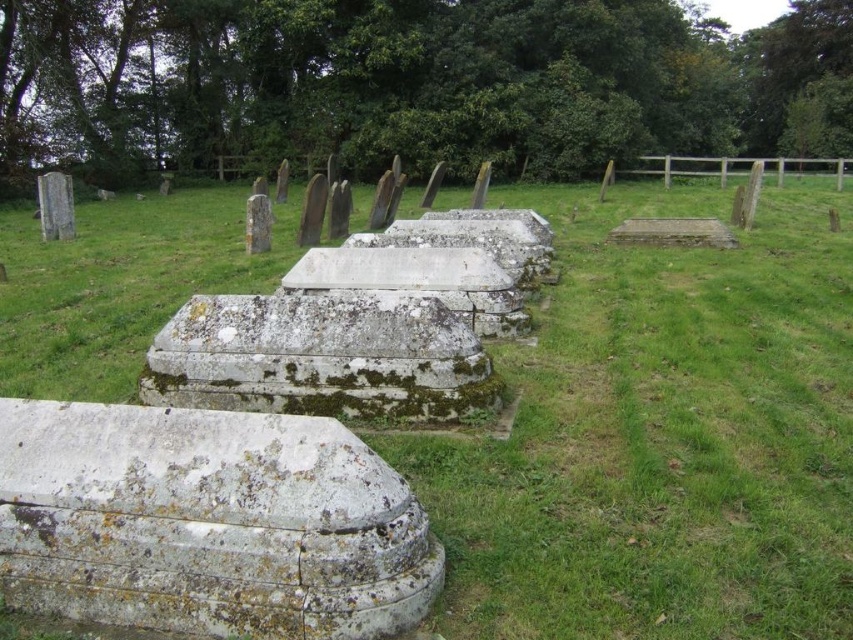
Question: Is green mossy stone at center behind mossy concrete sarcophagus at lower left?

Choices:
 (A) yes
 (B) no

Answer: (A)

Question: Which point appears farthest from the camera in this image?

Choices:
 (A) (44, 352)
 (B) (253, 321)

Answer: (A)

Question: Does green mossy stone at center appear on the right side of mossy concrete sarcophagus at lower left?

Choices:
 (A) no
 (B) yes

Answer: (A)

Question: Which point is farther to the camera?

Choices:
 (A) (292, 314)
 (B) (659, 316)

Answer: (B)

Question: Where is green mossy stone at center located in relation to mossy stone sarcophagus at center in the image?

Choices:
 (A) below
 (B) above

Answer: (B)

Question: Which of the following is the farthest from the observer?

Choices:
 (A) mossy concrete sarcophagus at lower left
 (B) mossy stone sarcophagus at center
 (C) green mossy stone at center

Answer: (B)